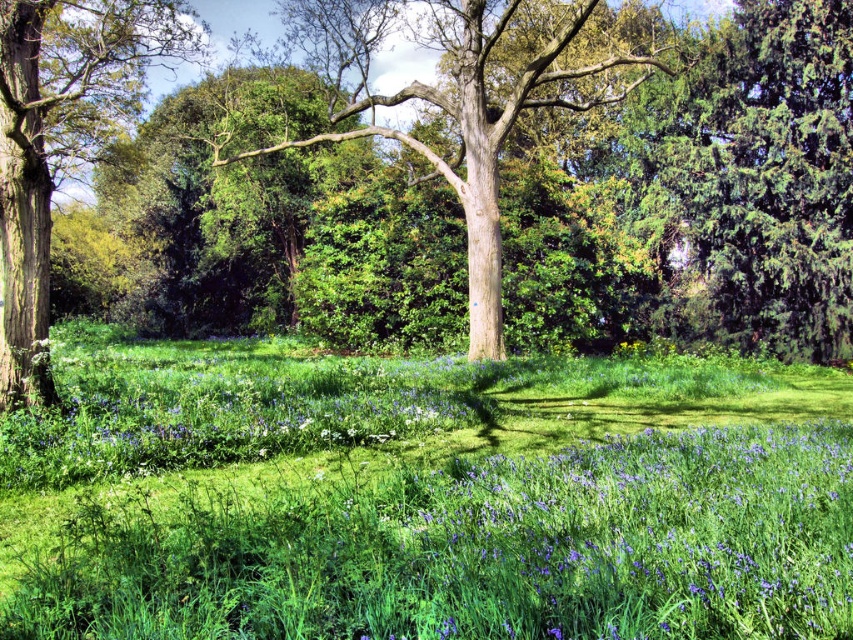
Question: Is purple matte flower at center further to the viewer compared to smooth brown tree trunk at left?

Choices:
 (A) yes
 (B) no

Answer: (B)

Question: Is the position of green grassy field at center less distant than that of smooth bark tree at center?

Choices:
 (A) yes
 (B) no

Answer: (A)

Question: Which point is farther to the camera?

Choices:
 (A) smooth bark tree at center
 (B) green textured evergreen tree at upper right

Answer: (B)

Question: Estimate the real-world distances between objects in this image. Which object is closer to the green textured evergreen tree at upper right?

Choices:
 (A) green grassy field at center
 (B) smooth bark tree at center
 (C) smooth brown tree trunk at left
 (D) purple matte flower at center

Answer: (B)

Question: Which object is closer to the camera taking this photo?

Choices:
 (A) smooth bark tree at center
 (B) purple matte flower at center
 (C) smooth brown tree trunk at left

Answer: (B)

Question: Does green grassy field at center appear on the left side of smooth brown tree trunk at left?

Choices:
 (A) no
 (B) yes

Answer: (A)